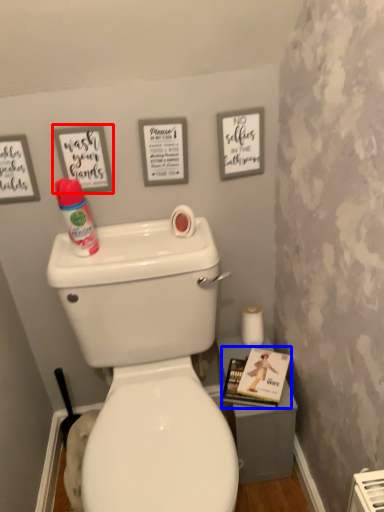
Question: Which object appears closest to the camera in this image, picture frame (highlighted by a red box) or magazine (highlighted by a blue box)?

Choices:
 (A) picture frame
 (B) magazine

Answer: (A)